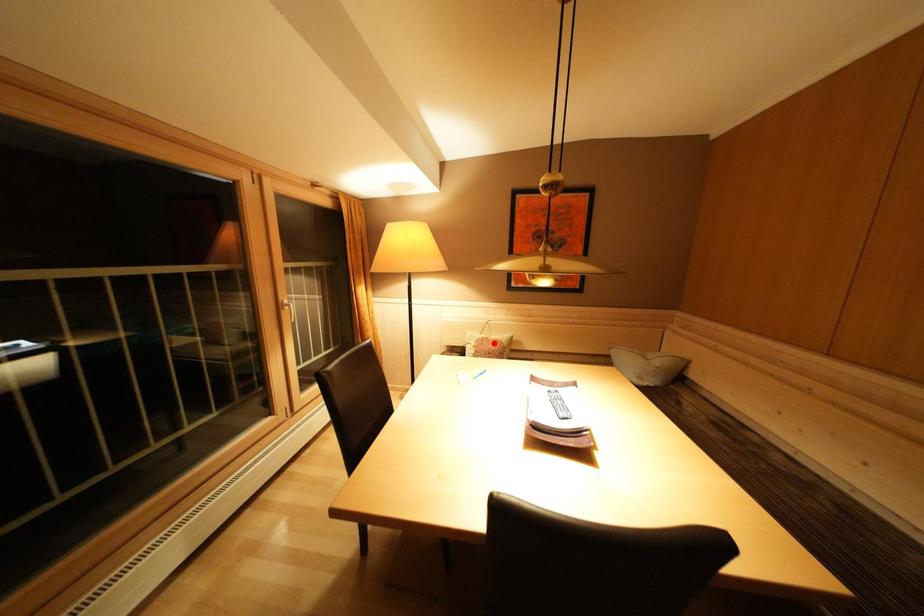
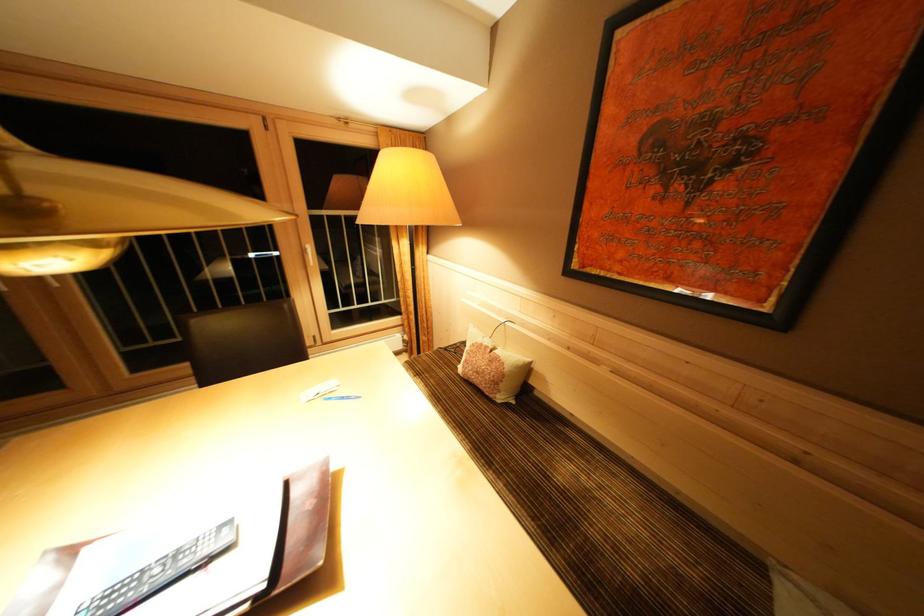
In the second image, find the point that corresponds to the highlighted location in the first image.

(493, 352)